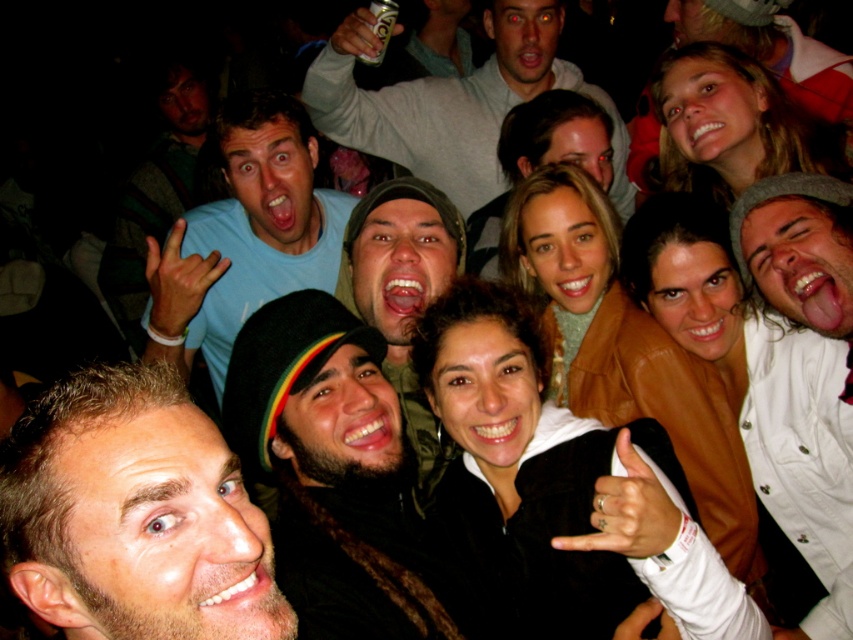
Which is in front, point (210, 515) or point (844, 374)?

Point (210, 515) is in front.

Image resolution: width=853 pixels, height=640 pixels. Identify the location of light brown hair at center. (132, 515).

Which is below, black knit cap at center or green textured hoodie at center?

black knit cap at center

What do you see at coordinates (335, 474) in the screenshot? I see `black knit cap at center` at bounding box center [335, 474].

Locate an element on the screen. The image size is (853, 640). black knit cap at center is located at coordinates (335, 474).

In the scene shown: Can you confirm if light brown hair at center is thinner than black knit cap at center?

Yes, light brown hair at center is thinner than black knit cap at center.

Between point (260, 620) and point (381, 408), which one is positioned in front?

Point (260, 620) is in front.

Is point (245, 566) farther from camera compared to point (368, 492)?

No, (245, 566) is in front of (368, 492).

Identify the location of light brown hair at center. (132, 515).